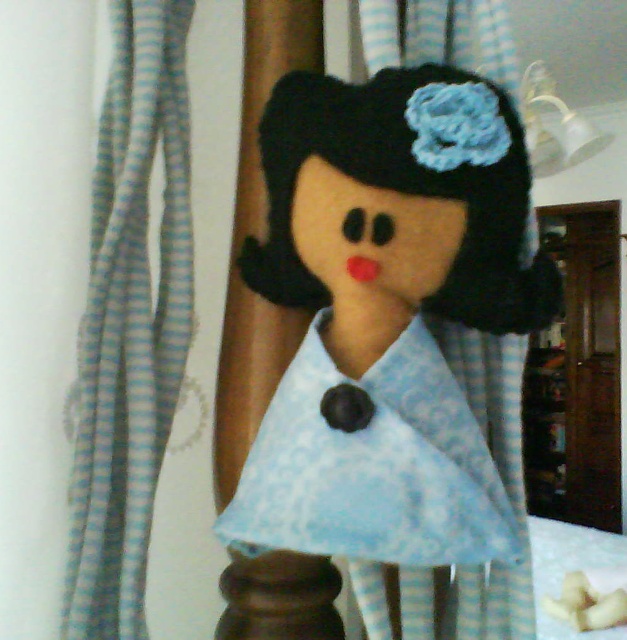
Question: Can you confirm if felt doll at center is positioned above light blue striped fabric at left?

Choices:
 (A) no
 (B) yes

Answer: (A)

Question: In this image, where is felt doll at center located relative to light blue striped fabric at left?

Choices:
 (A) below
 (B) above

Answer: (A)

Question: Is felt doll at center closer to camera compared to light blue striped fabric at left?

Choices:
 (A) yes
 (B) no

Answer: (A)

Question: Which point is closer to the camera?

Choices:
 (A) (182, 3)
 (B) (419, 312)

Answer: (B)